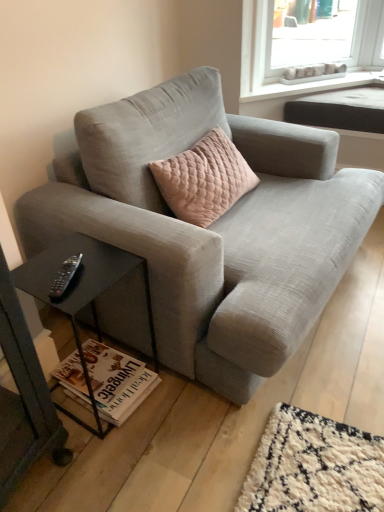
In order to face white paper magazine at lower left, should I rotate leftwards or rightwards?

Turn left by 11.850 degrees to look at white paper magazine at lower left.

You are a GUI agent. You are given a task and a screenshot of the screen. Output one action in this format:
    pyautogui.click(x=<x>, y=<y>)
    Task: Click on the white paper magazine at lower left
    
    Given the screenshot: What is the action you would take?
    pyautogui.click(x=117, y=381)

In order to click on black glass table at lower left in this screenshot , I will do `click(82, 292)`.

What do you see at coordinates (311, 86) in the screenshot?
I see `white matte window sill at upper center, which ranks as the second window sill in back-to-front order` at bounding box center [311, 86].

Where is `white paper magazine at lower left`? white paper magazine at lower left is located at coordinates (x=117, y=381).

Considering the sizes of objects black plastic remote at lower left and white paper magazine at lower left in the image provided, who is shorter, black plastic remote at lower left or white paper magazine at lower left?

With less height is black plastic remote at lower left.

Between point (57, 284) and point (99, 400), which one is positioned in front?

The point (57, 284) is more forward.

Can you confirm if black plastic remote at lower left is positioned to the right of white paper magazine at lower left?

In fact, black plastic remote at lower left is to the left of white paper magazine at lower left.

From a real-world perspective, which object rests below the other?

From a 3D spatial view, white paper magazine at lower left is below.

Which is behind, white paper magazine at lower left or white plastic tray at upper right, which is the second window sill in front-to-back order?

white plastic tray at upper right, which is the second window sill in front-to-back order, is more distant.

From a real-world perspective, which is physically below, white paper magazine at lower left or white plastic tray at upper right, which is the second window sill in front-to-back order?

white paper magazine at lower left, from a real-world perspective.

Consider the image. In terms of size, does white paper magazine at lower left appear bigger or smaller than white plastic tray at upper right, which is the second window sill in front-to-back order?

Considering their sizes, white paper magazine at lower left takes up less space than white plastic tray at upper right, which is the second window sill in front-to-back order.

Can you confirm if white matte window sill at upper center, positioned as the 1th window sill in front-to-back order, is wider than light gray fabric couch at center?

No, white matte window sill at upper center, positioned as the 1th window sill in front-to-back order, is not wider than light gray fabric couch at center.

From a real-world perspective, is white matte window sill at upper center, positioned as the 1th window sill in front-to-back order, above or below light gray fabric couch at center?

white matte window sill at upper center, positioned as the 1th window sill in front-to-back order, is situated higher than light gray fabric couch at center in the real world.

Is white matte window sill at upper center, which ranks as the second window sill in back-to-front order, not near light gray fabric couch at center?

That's right, there is a large distance between white matte window sill at upper center, which ranks as the second window sill in back-to-front order, and light gray fabric couch at center.

Based on the photo, from the image's perspective, which is below, white matte window sill at upper center, positioned as the 1th window sill in front-to-back order, or light gray fabric couch at center?

light gray fabric couch at center, from the image's perspective.

Is point (61, 385) farther from camera compared to point (63, 311)?

Yes.

From the picture: Which object is positioned more to the right, white paper magazine at lower left or black glass table at lower left?

From the viewer's perspective, white paper magazine at lower left appears more on the right side.

From a real-world perspective, is white paper magazine at lower left positioned above or below black glass table at lower left?

In terms of real-world spatial position, white paper magazine at lower left is below black glass table at lower left.

From the image's perspective, is white paper magazine at lower left over black glass table at lower left?

No, from the image's perspective, white paper magazine at lower left is not over black glass table at lower left.

Does point (61, 410) lie in front of point (113, 404)?

No, (61, 410) is behind (113, 404).

In the scene shown: Between black glass table at lower left and white paper magazine at lower left, which one is positioned behind?

white paper magazine at lower left.

In terms of width, does black glass table at lower left look wider or thinner when compared to white paper magazine at lower left?

Considering their sizes, black glass table at lower left looks slimmer than white paper magazine at lower left.

Between black plastic remote at lower left and white matte window sill at upper center, which ranks as the second window sill in back-to-front order, which one has smaller width?

With smaller width is black plastic remote at lower left.

Measure the distance from black plastic remote at lower left to white matte window sill at upper center, positioned as the 1th window sill in front-to-back order.

black plastic remote at lower left is 6.56 feet from white matte window sill at upper center, positioned as the 1th window sill in front-to-back order.

Is black plastic remote at lower left positioned beyond the bounds of white matte window sill at upper center, positioned as the 1th window sill in front-to-back order?

Yes, black plastic remote at lower left is not within white matte window sill at upper center, positioned as the 1th window sill in front-to-back order.

At what (x,y) coordinates should I click in order to perform the action: click on remote in front of the white matte window sill at upper center, which ranks as the second window sill in back-to-front order. Please return your answer as a coordinate pair (x, y). The image size is (384, 512). Looking at the image, I should click on (65, 277).

Considering the sizes of light gray fabric couch at center and black glass table at lower left in the image, is light gray fabric couch at center taller or shorter than black glass table at lower left?

light gray fabric couch at center is taller than black glass table at lower left.

Is light gray fabric couch at center to the left of black glass table at lower left from the viewer's perspective?

No.

How different are the orientations of light gray fabric couch at center and black glass table at lower left in degrees?

There is a 0.264-degree angle between the facing directions of light gray fabric couch at center and black glass table at lower left.

Where is `remote above the white paper magazine at lower left (from the image's perspective)`? This screenshot has width=384, height=512. remote above the white paper magazine at lower left (from the image's perspective) is located at coordinates (65, 277).

This screenshot has height=512, width=384. What are the coordinates of `window sill that is the 2nd object above the white paper magazine at lower left (from a real-world perspective)` in the screenshot? It's located at (311, 78).

Considering their positions, is white paper magazine at lower left positioned further to black glass table at lower left than light gray fabric couch at center?

light gray fabric couch at center lies further to black glass table at lower left than the other object.

Which object lies further to the anchor point black plastic remote at lower left, white matte window sill at upper center, positioned as the 1th window sill in front-to-back order, or white paper magazine at lower left?

white matte window sill at upper center, positioned as the 1th window sill in front-to-back order, lies further to black plastic remote at lower left than the other object.

From the image, which object appears to be nearer to light gray fabric couch at center, white matte window sill at upper center, positioned as the 1th window sill in front-to-back order, or white plastic tray at upper right, which is the second window sill in front-to-back order?

white matte window sill at upper center, positioned as the 1th window sill in front-to-back order, lies closer to light gray fabric couch at center than the other object.

From the image, which object appears to be farther from black glass table at lower left, white matte window sill at upper center, which ranks as the second window sill in back-to-front order, or white plastic tray at upper right, which is the second window sill in front-to-back order?

white plastic tray at upper right, which is the second window sill in front-to-back order, is further to black glass table at lower left.

Based on their spatial positions, is white plastic tray at upper right, which is counted as the first window sill, starting from the back, or white paper magazine at lower left further from black plastic remote at lower left?

white plastic tray at upper right, which is counted as the first window sill, starting from the back.

From the image, which object appears to be farther from black glass table at lower left, white plastic tray at upper right, which is counted as the first window sill, starting from the back, or light gray fabric couch at center?

white plastic tray at upper right, which is counted as the first window sill, starting from the back, is further to black glass table at lower left.

Which object lies nearer to the anchor point black glass table at lower left, black plastic remote at lower left or white plastic tray at upper right, which is the second window sill in front-to-back order?

black plastic remote at lower left is positioned closer to the anchor black glass table at lower left.

When comparing their distances from white matte window sill at upper center, which ranks as the second window sill in back-to-front order, does light gray fabric couch at center or white plastic tray at upper right, which is counted as the first window sill, starting from the back, seem closer?

white plastic tray at upper right, which is counted as the first window sill, starting from the back, is closer to white matte window sill at upper center, which ranks as the second window sill in back-to-front order.

In order to click on table between white plastic tray at upper right, which is the second window sill in front-to-back order, and white paper magazine at lower left, in the vertical direction in this screenshot , I will do `click(82, 292)`.

Image resolution: width=384 pixels, height=512 pixels. I want to click on table situated between black plastic remote at lower left and light gray fabric couch at center from left to right, so click(82, 292).

Where is `magazine positioned between light gray fabric couch at center and white plastic tray at upper right, which is counted as the first window sill, starting from the back, from near to far`? The image size is (384, 512). magazine positioned between light gray fabric couch at center and white plastic tray at upper right, which is counted as the first window sill, starting from the back, from near to far is located at coordinates (117, 381).

You are a GUI agent. You are given a task and a screenshot of the screen. Output one action in this format:
    pyautogui.click(x=<x>, y=<y>)
    Task: Click on the remote between white matte window sill at upper center, positioned as the 1th window sill in front-to-back order, and black glass table at lower left in the up-down direction
    
    Given the screenshot: What is the action you would take?
    pyautogui.click(x=65, y=277)